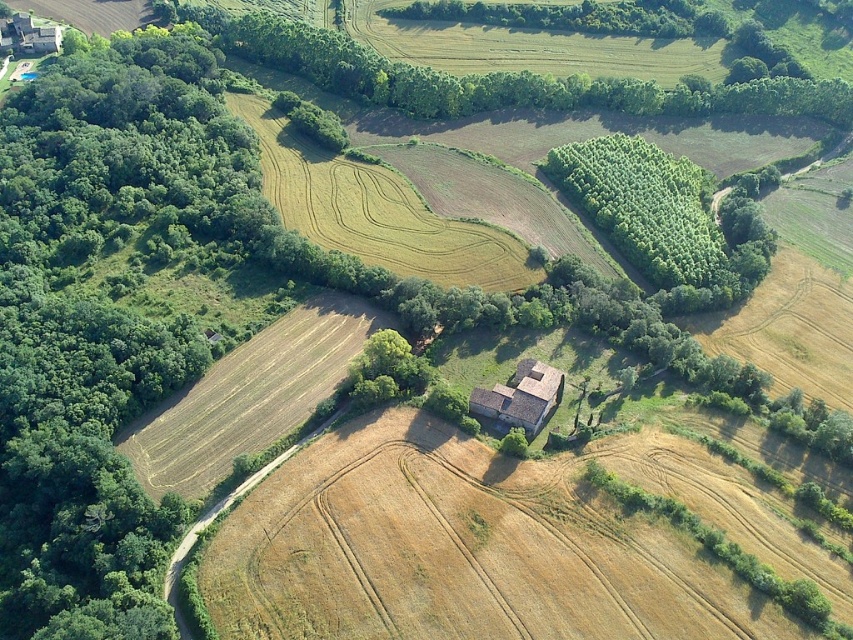
Question: Can you confirm if green leafy trees at center-right is positioned below brown stone barn at center?

Choices:
 (A) yes
 (B) no

Answer: (B)

Question: Which object is farther from the camera taking this photo?

Choices:
 (A) green leafy trees at center-right
 (B) brown stone barn at center

Answer: (A)

Question: Can you confirm if green leafy trees at center-right is positioned below brown stone barn at center?

Choices:
 (A) yes
 (B) no

Answer: (B)

Question: Can you confirm if green leafy trees at center-right is positioned to the left of brown stone barn at center?

Choices:
 (A) yes
 (B) no

Answer: (B)

Question: Among these objects, which one is farthest from the camera?

Choices:
 (A) brown stone barn at center
 (B) green leafy trees at center-right

Answer: (B)